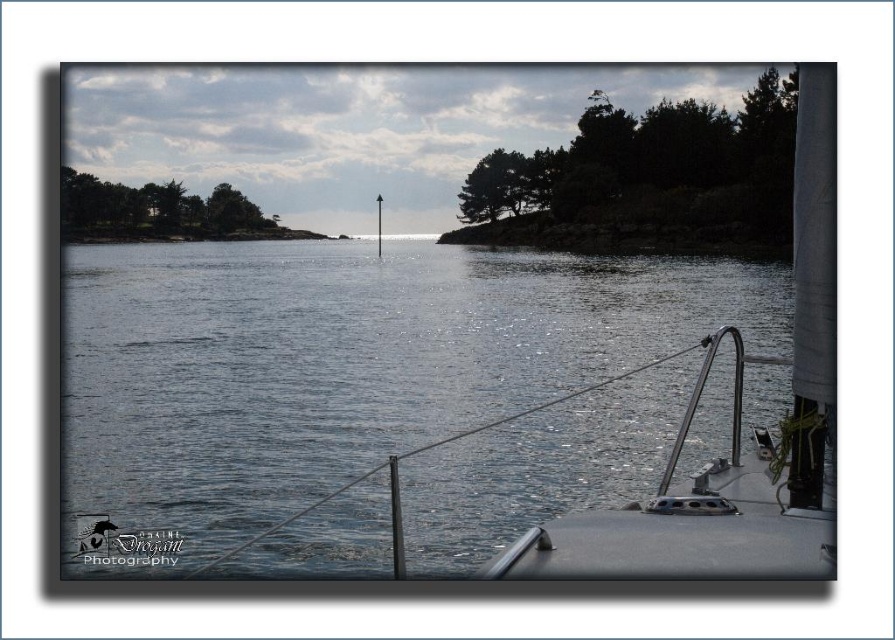
You are an observer on the deck of the boat. You notice the glossy water at center and the polished stainless steel boat at right. Which object occupies a bigger area in your field of view?

The glossy water at center is larger in size than the polished stainless steel boat at right, so it occupies a bigger area in your field of view.

You are an observer on the boat deck. You see the glossy water at center and the polished stainless steel boat at right. Which object appears taller in the scene?

The glossy water at center appears taller than the polished stainless steel boat at right.